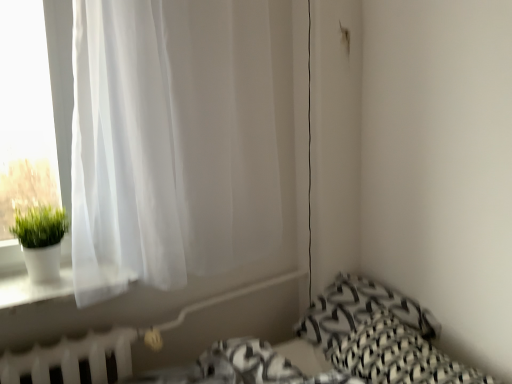
Question: Is black woven pillow at lower right, the 1th pillow when ordered from front to back, taller than white plastic radiator at lower left?

Choices:
 (A) yes
 (B) no

Answer: (B)

Question: Is white plastic radiator at lower left at the back of black woven pillow at lower right, the second pillow positioned from the back?

Choices:
 (A) yes
 (B) no

Answer: (B)

Question: From the image's perspective, does black woven pillow at lower right, the second pillow positioned from the back, appear higher than white plastic radiator at lower left?

Choices:
 (A) no
 (B) yes

Answer: (B)

Question: Considering the relative sizes of black woven pillow at lower right, the second pillow positioned from the back, and white plastic radiator at lower left in the image provided, is black woven pillow at lower right, the second pillow positioned from the back, thinner than white plastic radiator at lower left?

Choices:
 (A) no
 (B) yes

Answer: (A)

Question: Is black woven pillow at lower right, the second pillow positioned from the back, outside white plastic radiator at lower left?

Choices:
 (A) yes
 (B) no

Answer: (A)

Question: Considering the positions of white matte pot at left and white plastic radiator at lower left in the image, is white matte pot at left wider or thinner than white plastic radiator at lower left?

Choices:
 (A) wide
 (B) thin

Answer: (A)

Question: Considering the positions of point click(x=55, y=269) and point click(x=56, y=364), is point click(x=55, y=269) closer or farther from the camera than point click(x=56, y=364)?

Choices:
 (A) closer
 (B) farther

Answer: (B)

Question: Considering the relative positions of white matte pot at left and white plastic radiator at lower left in the image provided, is white matte pot at left to the left or to the right of white plastic radiator at lower left?

Choices:
 (A) left
 (B) right

Answer: (A)

Question: Looking at the image, does white matte pot at left seem bigger or smaller compared to white plastic radiator at lower left?

Choices:
 (A) big
 (B) small

Answer: (A)

Question: In terms of width, does white sheer curtain at left look wider or thinner when compared to black woven pillow at lower right, the second pillow positioned from the back?

Choices:
 (A) thin
 (B) wide

Answer: (A)

Question: Is white sheer curtain at left spatially inside black woven pillow at lower right, the second pillow positioned from the back, or outside of it?

Choices:
 (A) inside
 (B) outside

Answer: (B)

Question: Does point (258, 200) appear closer or farther from the camera than point (435, 380)?

Choices:
 (A) closer
 (B) farther

Answer: (B)

Question: From the image's perspective, is white sheer curtain at left positioned above or below black woven pillow at lower right, the 1th pillow when ordered from front to back?

Choices:
 (A) below
 (B) above

Answer: (B)

Question: Does point (24, 223) appear closer or farther from the camera than point (360, 327)?

Choices:
 (A) closer
 (B) farther

Answer: (A)

Question: Considering the positions of white matte pot at left and black woven pillow at lower right, the 1th pillow when ordered from front to back, in the image, is white matte pot at left wider or thinner than black woven pillow at lower right, the 1th pillow when ordered from front to back,?

Choices:
 (A) wide
 (B) thin

Answer: (B)